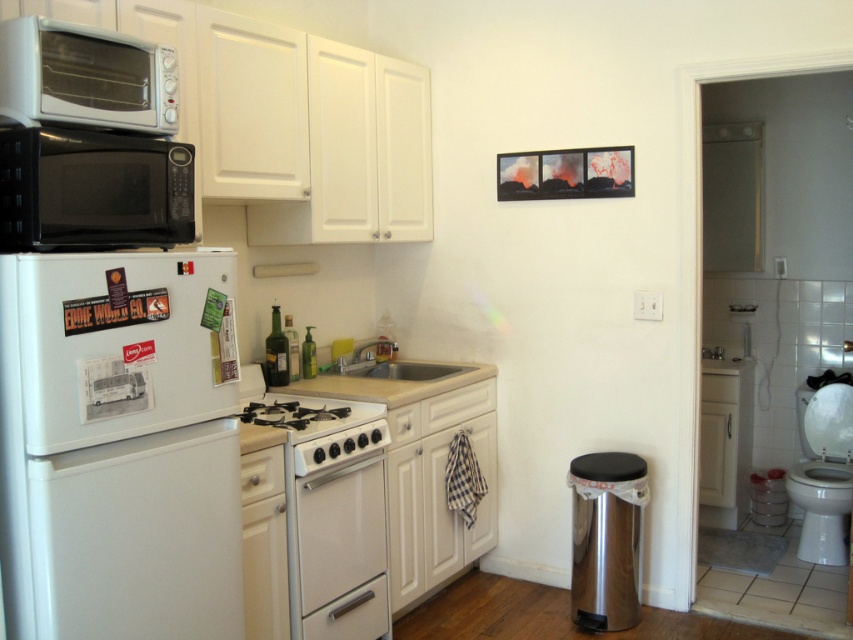
Who is higher up, black matte microwave at upper left or white glossy stove at center?

black matte microwave at upper left is higher up.

Between black matte microwave at upper left and white glossy stove at center, which one appears on the left side from the viewer's perspective?

black matte microwave at upper left

Does point (10, 154) come closer to viewer compared to point (339, 422)?

Yes, point (10, 154) is closer to viewer.

Find the location of a particular element. The image size is (853, 640). black matte microwave at upper left is located at coordinates (91, 189).

Which is in front, point (146, 160) or point (434, 376)?

Point (146, 160)

Is black matte microwave at upper left above white porcelain sink at center?

Correct, black matte microwave at upper left is located above white porcelain sink at center.

Locate an element on the screen. black matte microwave at upper left is located at coordinates (91, 189).

Where is `black matte microwave at upper left`? black matte microwave at upper left is located at coordinates (91, 189).

Does point (169, 92) come closer to viewer compared to point (834, 524)?

Yes.

The width and height of the screenshot is (853, 640). I want to click on white plastic microwave at upper left, so click(85, 77).